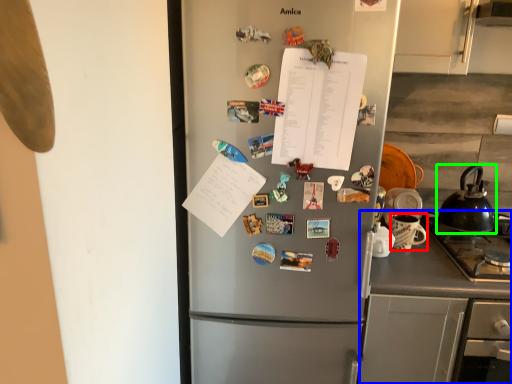
Question: Which is nearer to the appliance (highlighted by a red box)? counter (highlighted by a blue box) or kettle (highlighted by a green box).

Choices:
 (A) counter
 (B) kettle

Answer: (B)